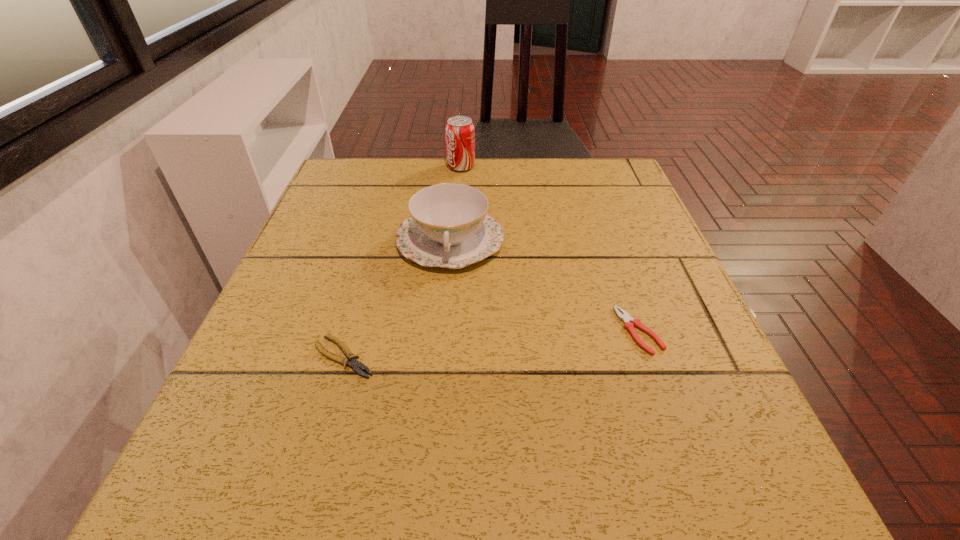
You are a GUI agent. You are given a task and a screenshot of the screen. Output one action in this format:
    pyautogui.click(x=<x>, y=<y>)
    Task: Click on the free space that satisfies the following two spatial constraints: 1. on the back side of the right pliers; 2. on the left side of the left pliers
    
    Given the screenshot: What is the action you would take?
    pyautogui.click(x=351, y=331)

Identify the location of vacant point that satisfies the following two spatial constraints: 1. on the back side of the left pliers; 2. on the right side of the farthest object. The width and height of the screenshot is (960, 540). (398, 167).

This screenshot has height=540, width=960. Identify the location of vacant space that satisfies the following two spatial constraints: 1. on the back side of the soda; 2. on the left side of the left pliers. (398, 167).

Where is `vacant space that satisfies the following two spatial constraints: 1. on the handle side of the right pliers; 2. on the left side of the second farthest object`? This screenshot has height=540, width=960. vacant space that satisfies the following two spatial constraints: 1. on the handle side of the right pliers; 2. on the left side of the second farthest object is located at coordinates (443, 331).